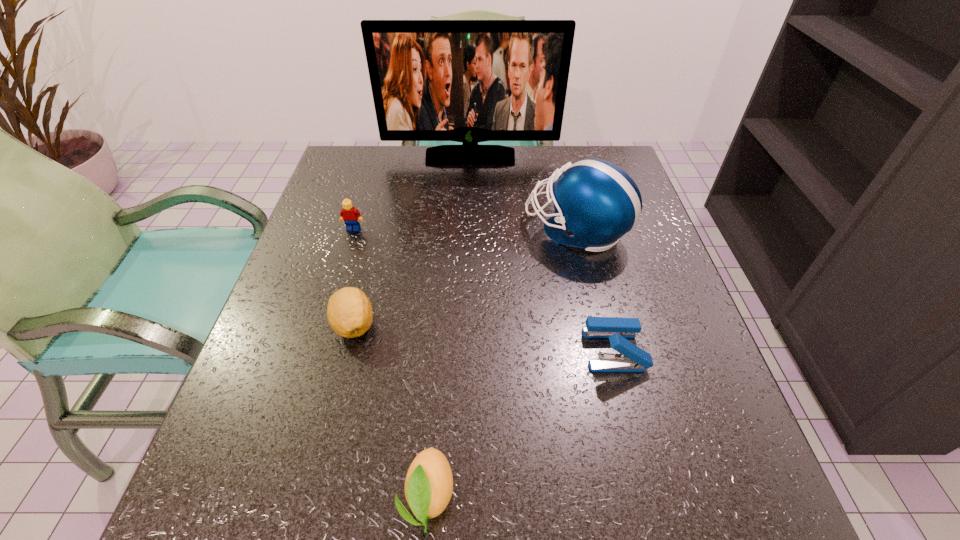
Locate an element on the screen. This screenshot has height=540, width=960. object identified as the second closest to the farthest object is located at coordinates (351, 216).

Point out which object is positioned as the fifth nearest to the second tallest object. Please provide its 2D coordinates. Your answer should be formatted as a tuple, i.e. [(x, y)], where the tuple contains the x and y coordinates of a point satisfying the conditions above.

[(429, 482)]

Identify the location of free location that satisfies the following two spatial constraints: 1. at the front of the fifth shortest object with the faceguard; 2. at the stem end of the left lemon. (598, 325).

Locate an element on the screen. free location that satisfies the following two spatial constraints: 1. on the front-facing side of the monitor; 2. on the left side of the stapler is located at coordinates (465, 349).

Locate an element on the screen. vacant space that satisfies the following two spatial constraints: 1. at the front of the football helmet with the faceguard; 2. on the right side of the stapler is located at coordinates tap(605, 349).

Where is `free location that satisfies the following two spatial constraints: 1. at the front of the football helmet with the faceguard; 2. at the stem end of the farther lemon`? This screenshot has height=540, width=960. free location that satisfies the following two spatial constraints: 1. at the front of the football helmet with the faceguard; 2. at the stem end of the farther lemon is located at coordinates (598, 325).

Locate an element on the screen. This screenshot has width=960, height=540. vacant region that satisfies the following two spatial constraints: 1. on the front-facing side of the Lego; 2. on the right side of the stapler is located at coordinates (316, 349).